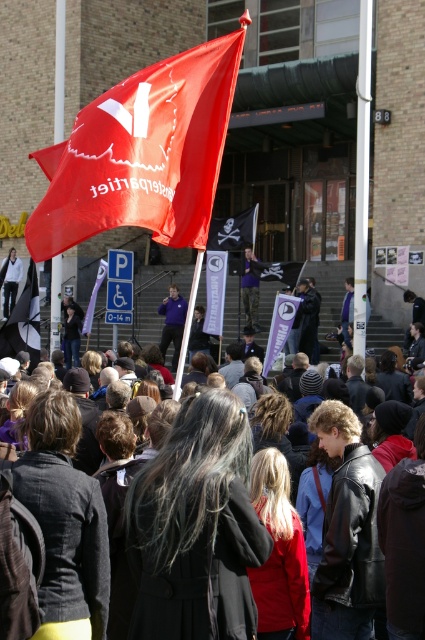
You are a photographer trying to capture the dark gray coat at center and the matte purple banner at center in the same frame. Which object is closer to the camera based on their positions?

The dark gray coat at center is located below the matte purple banner at center, so the matte purple banner at center is closer to the camera.

In the scene shown: What is the 2D coordinate of the black and white fabric flag at left in the image?

The 2D coordinate of the black and white fabric flag at left is at point (23, 321).

You are a photographer trying to capture the scene of the protest. You want to ensure both the matte black jacket at lower left and the red fabric flag at center are visible in your shot. Given their sizes, which object should you focus on to frame the shot appropriately?

The matte black jacket at lower left occupies less space than the red fabric flag at center, so you should focus on the red fabric flag at center to ensure it is centered and properly framed, while the smaller matte black jacket at lower left will naturally fit into the composition without overcrowding the frame.